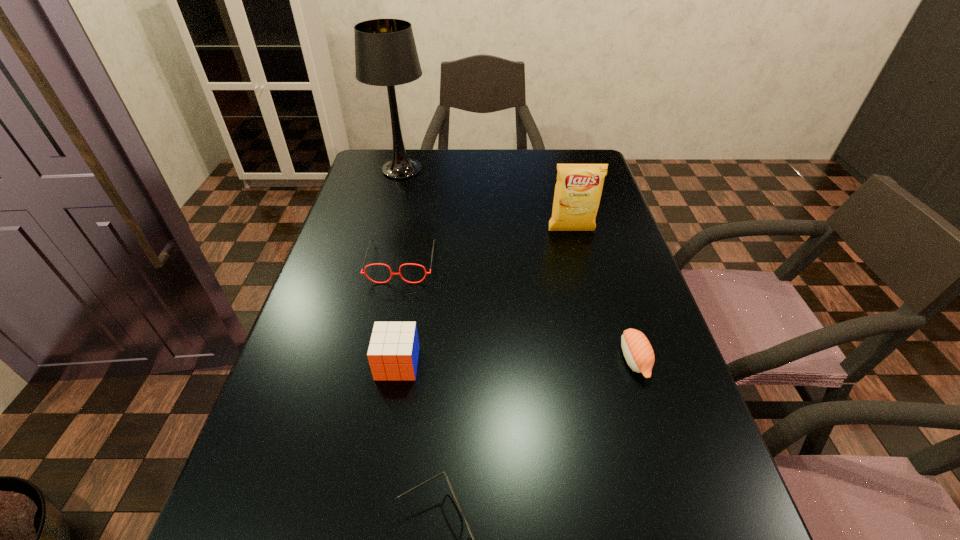
The height and width of the screenshot is (540, 960). In order to click on free space at the left edge in this screenshot , I will do `click(344, 271)`.

In the image, there is a desktop. At what (x,y) coordinates should I click in order to perform the action: click on vacant space at the right edge. Please return your answer as a coordinate pair (x, y). The image size is (960, 540). Looking at the image, I should click on (580, 275).

This screenshot has height=540, width=960. What are the coordinates of `vacant space at the far right corner` in the screenshot? It's located at (557, 149).

What are the coordinates of `empty location between the fifth nearest object and the farthest object` in the screenshot? It's located at (487, 200).

Image resolution: width=960 pixels, height=540 pixels. What are the coordinates of `free space between the cube and the sushi` in the screenshot? It's located at (516, 361).

The width and height of the screenshot is (960, 540). Find the location of `free space between the cube and the tallest object`. free space between the cube and the tallest object is located at coordinates (399, 267).

Where is `vacant area between the fifth shortest object and the sushi`? vacant area between the fifth shortest object and the sushi is located at coordinates (603, 295).

Image resolution: width=960 pixels, height=540 pixels. What are the coordinates of `free space between the fifth nearest object and the sushi` in the screenshot? It's located at (603, 295).

The image size is (960, 540). In order to click on free space between the second tallest object and the fourth nearest object in this screenshot , I will do `click(487, 247)`.

Identify the location of unoccupied area between the sushi and the fourth nearest object. The width and height of the screenshot is (960, 540). (518, 311).